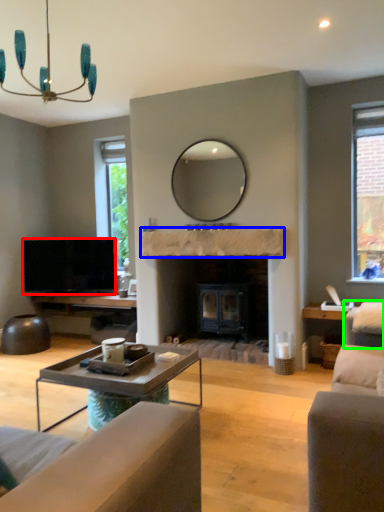
Question: Based on their relative distances, which object is farther from television (highlighted by a red box)? Choose from mantle (highlighted by a blue box) and swivel chair (highlighted by a green box).

Choices:
 (A) mantle
 (B) swivel chair

Answer: (B)